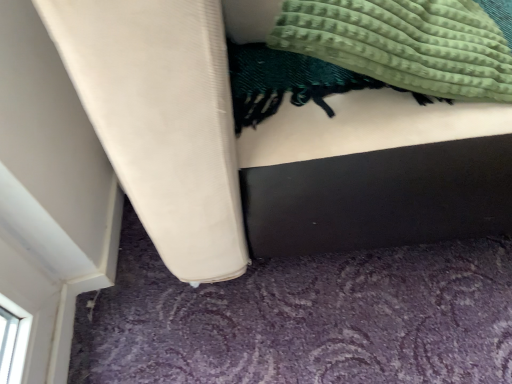
Question: Which is correct: green textured blanket at upper right is inside matte white bed at center, or outside of it?

Choices:
 (A) inside
 (B) outside

Answer: (A)

Question: Is point (371, 77) positioned closer to the camera than point (138, 162)?

Choices:
 (A) closer
 (B) farther

Answer: (B)

Question: Based on their positions, is green textured blanket at upper right located to the left or right of matte white bed at center?

Choices:
 (A) left
 (B) right

Answer: (A)

Question: From the image's perspective, relative to green textured blanket at upper right, is matte white bed at center above or below?

Choices:
 (A) above
 (B) below

Answer: (A)

Question: Based on their positions, is matte white bed at center located to the left or right of green textured blanket at upper right?

Choices:
 (A) left
 (B) right

Answer: (B)

Question: Is matte white bed at center in front of or behind green textured blanket at upper right in the image?

Choices:
 (A) front
 (B) behind

Answer: (A)

Question: Considering the positions of matte white bed at center and green textured blanket at upper right in the image, is matte white bed at center wider or thinner than green textured blanket at upper right?

Choices:
 (A) wide
 (B) thin

Answer: (A)